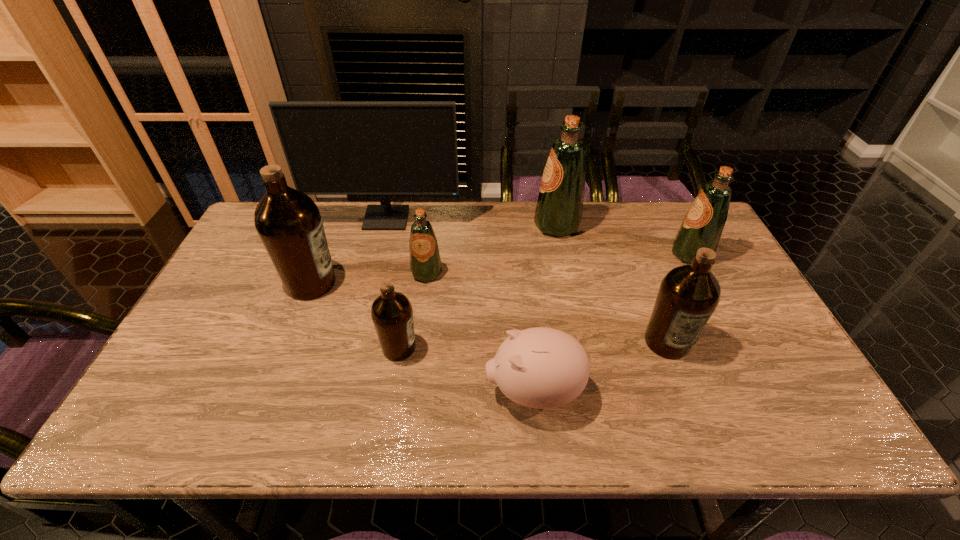
At what (x,y) coordinates should I click in order to perform the action: click on the second brown olive oil from right to left. Please return your answer as a coordinate pair (x, y). The image size is (960, 540). Looking at the image, I should click on (391, 312).

Locate an element on the screen. The width and height of the screenshot is (960, 540). the shortest object is located at coordinates (541, 368).

Locate an element on the screen. Image resolution: width=960 pixels, height=540 pixels. free space located 0.130m on the front-facing side of the computer monitor is located at coordinates (377, 257).

This screenshot has height=540, width=960. In order to click on vacant space located 0.370m on the front-facing side of the farthest green olive oil in this screenshot , I will do `click(423, 226)`.

Find the location of a particular element. free space located on the front-facing side of the farthest green olive oil is located at coordinates (492, 226).

I want to click on free location located on the front-facing side of the farthest green olive oil, so click(x=471, y=226).

Find the location of a particular element. Image resolution: width=960 pixels, height=540 pixels. free space located 0.360m on the label of the leftmost brown olive oil is located at coordinates (463, 284).

What are the coordinates of `free space located on the front-facing side of the rightmost olive oil` in the screenshot? It's located at (587, 254).

Image resolution: width=960 pixels, height=540 pixels. In order to click on vacant space located on the front-facing side of the rightmost olive oil in this screenshot , I will do `click(610, 254)`.

Where is `free space located 0.100m on the front-facing side of the rightmost olive oil`? This screenshot has width=960, height=540. free space located 0.100m on the front-facing side of the rightmost olive oil is located at coordinates click(638, 254).